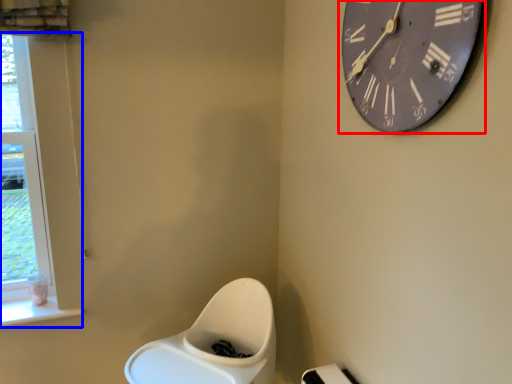
Question: Among these objects, which one is farthest to the camera, wall clock (highlighted by a red box) or window (highlighted by a blue box)?

Choices:
 (A) wall clock
 (B) window

Answer: (B)